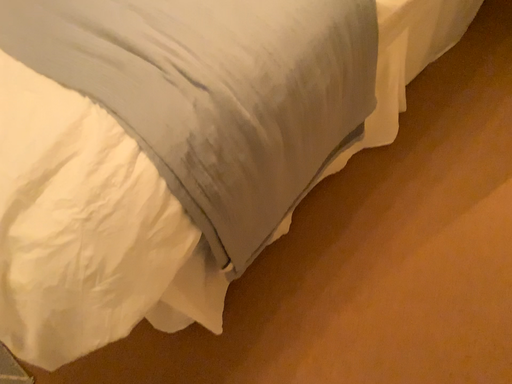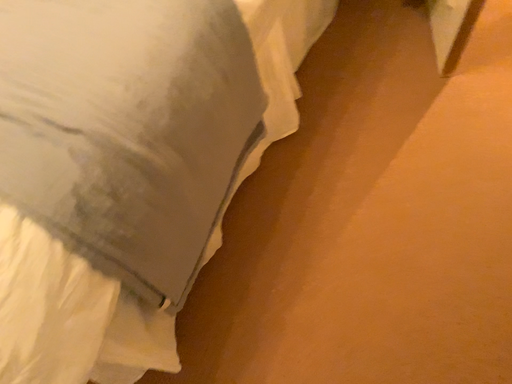
Question: How did the camera likely rotate when shooting the video?

Choices:
 (A) rotated left
 (B) rotated right

Answer: (B)